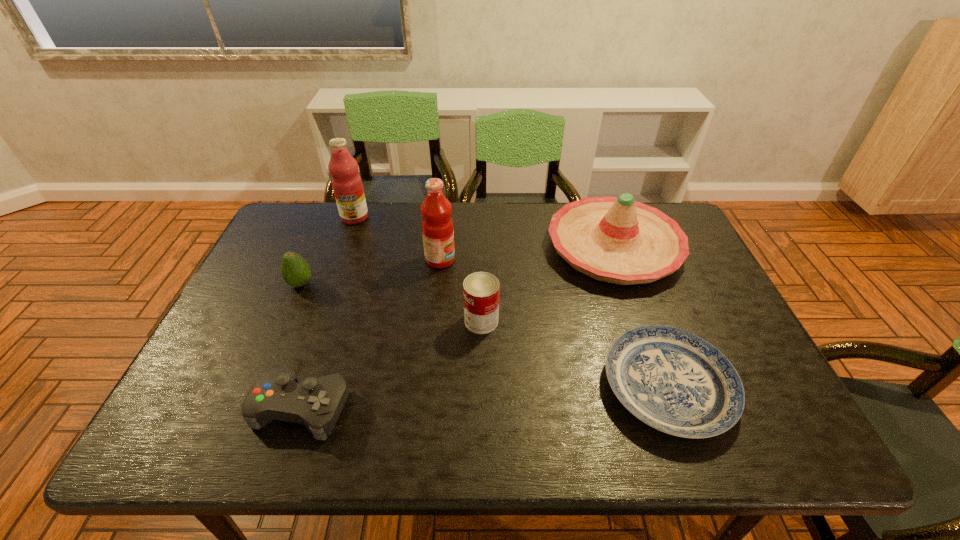
Find the location of `free space between the shortest object and the farther fruit juice`. free space between the shortest object and the farther fruit juice is located at coordinates (512, 302).

Find the location of a particular element. the fifth closest object to the farther fruit juice is located at coordinates (316, 403).

What are the coordinates of `object that can be found as the closest to the second shortest object` in the screenshot? It's located at (295, 270).

Identify the location of free space that satisfies the following two spatial constraints: 1. on the back side of the shortest object; 2. on the front label of the can. The image size is (960, 540). (644, 321).

What are the coordinates of `free space in the image that satisfies the following two spatial constraints: 1. on the front label of the can; 2. on the front side of the sixth tallest object` in the screenshot? It's located at (482, 407).